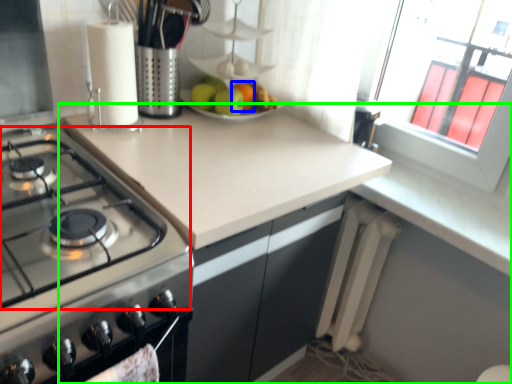
Question: Which object is positioned closest to gas stove (highlighted by a red box)? Select from orange (highlighted by a blue box) and countertop (highlighted by a green box).

Choices:
 (A) orange
 (B) countertop

Answer: (B)